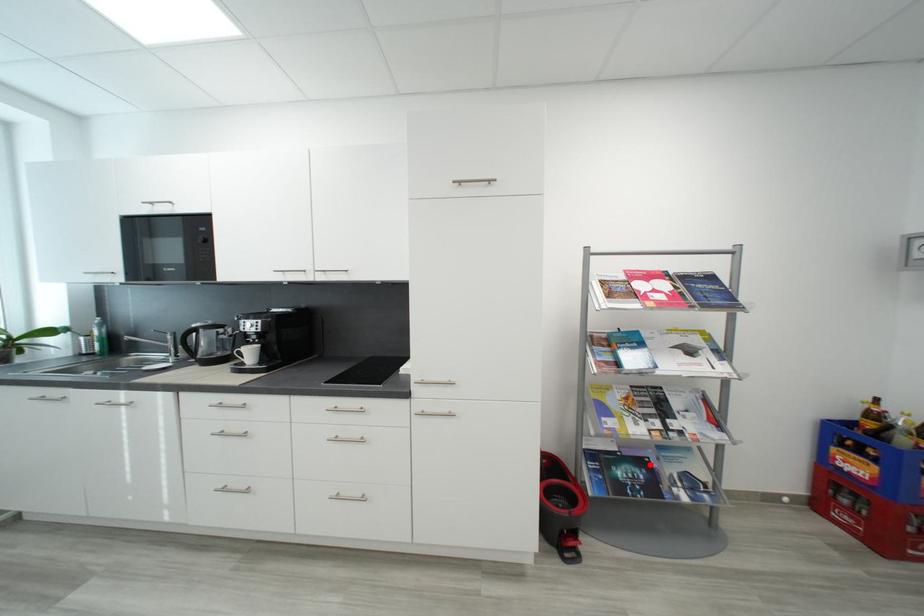
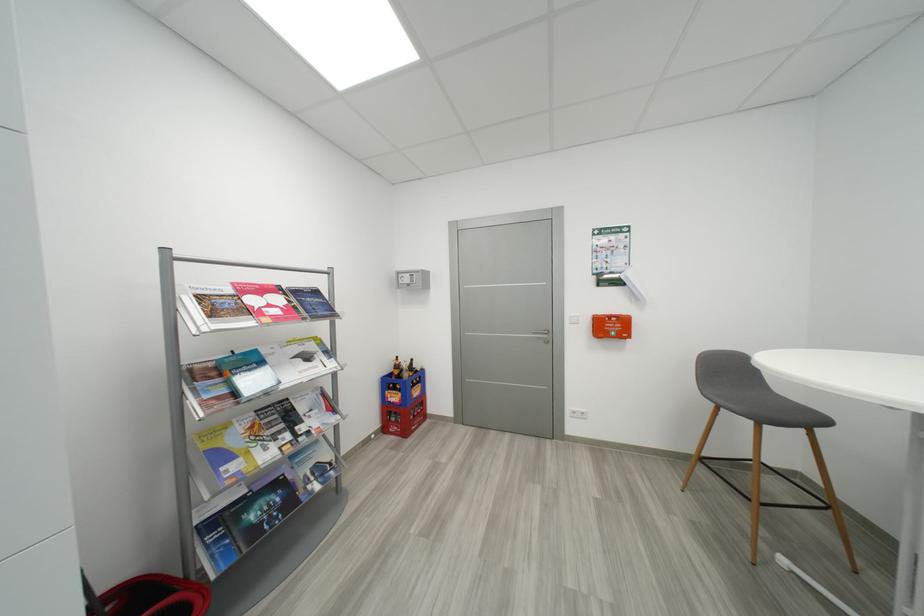
Find the pixel in the second image that matches the highlighted location in the first image.

(285, 485)